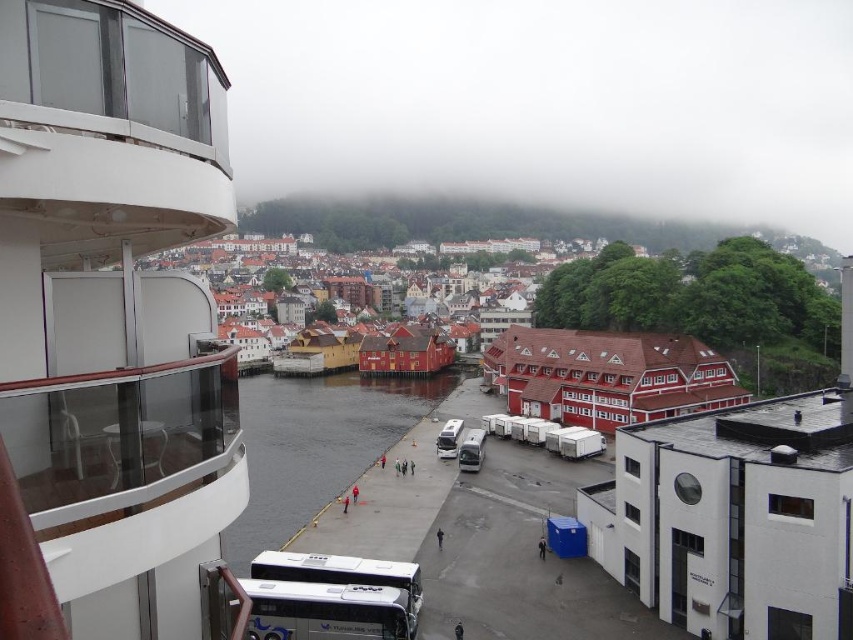
Question: Estimate the real-world distances between objects in this image. Which object is farther from the white glossy cruise ship at left?

Choices:
 (A) reddish-brown wooden houses at center
 (B) white matte/deck bus at lower center
 (C) dark gray concrete river at center
 (D) silver metallic van at center

Answer: (A)

Question: Based on their relative distances, which object is nearer to the white glossy cruise ship at left?

Choices:
 (A) silver metallic van at center
 (B) reddish-brown wooden houses at center

Answer: (A)

Question: Which object appears closest to the camera in this image?

Choices:
 (A) dark gray concrete river at center
 (B) silver metallic van at center
 (C) white glossy cruise ship at left
 (D) white matte/deck bus at lower center

Answer: (C)

Question: Can you confirm if white glossy cruise ship at left is thinner than white matte/deck bus at lower center?

Choices:
 (A) yes
 (B) no

Answer: (B)

Question: Is white glossy cruise ship at left smaller than white matte/deck bus at lower center?

Choices:
 (A) yes
 (B) no

Answer: (B)

Question: Is white glossy cruise ship at left to the right of dark gray concrete river at center from the viewer's perspective?

Choices:
 (A) no
 (B) yes

Answer: (B)